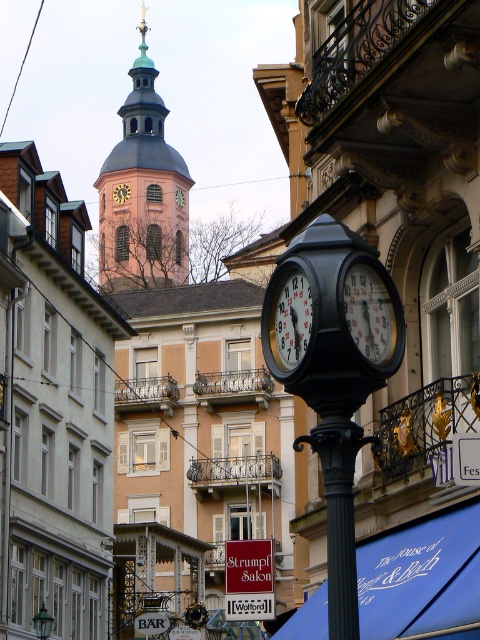
You are standing in the middle of the street looking at the scene. Where is the metallic clock face at center located in terms of its 2D position?

The metallic clock face at center is located at the 2D coordinates point (370, 314).